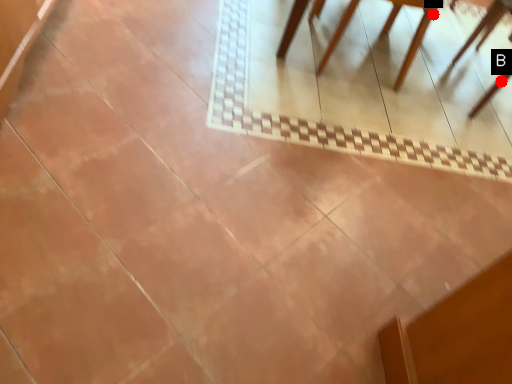
Question: Two points are circled on the image, labeled by A and B beside each circle. Which point is further to the camera?

Choices:
 (A) A is further
 (B) B is further

Answer: (A)